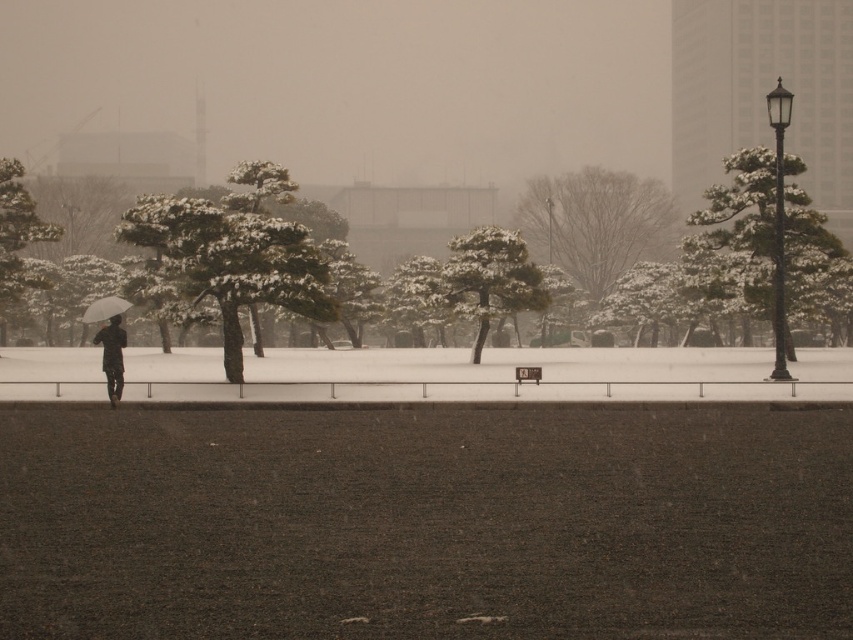
Does snow-covered pine tree at right have a lesser width compared to snow-covered tree at center?

Correct, snow-covered pine tree at right's width is less than snow-covered tree at center's.

Which is below, snow-covered pine tree at right or snow-covered tree at center?

snow-covered pine tree at right is below.

You are a GUI agent. You are given a task and a screenshot of the screen. Output one action in this format:
    pyautogui.click(x=<x>, y=<y>)
    Task: Click on the snow-covered pine tree at right
    
    Given the screenshot: What is the action you would take?
    pyautogui.click(x=737, y=232)

Locate an element on the screen. The width and height of the screenshot is (853, 640). snow-covered pine tree at right is located at coordinates (737, 232).

Is snow-covered pine tree at right thinner than white matte umbrella at left?

Indeed, snow-covered pine tree at right has a lesser width compared to white matte umbrella at left.

Who is taller, snow-covered pine tree at right or white matte umbrella at left?

snow-covered pine tree at right

The width and height of the screenshot is (853, 640). I want to click on snow-covered pine tree at right, so click(x=737, y=232).

Which is in front, point (531, 291) or point (131, 305)?

Point (131, 305) is more forward.

What do you see at coordinates (490, 278) in the screenshot? This screenshot has width=853, height=640. I see `snow-covered pine tree at center` at bounding box center [490, 278].

The width and height of the screenshot is (853, 640). What are the coordinates of `snow-covered pine tree at center` in the screenshot? It's located at (490, 278).